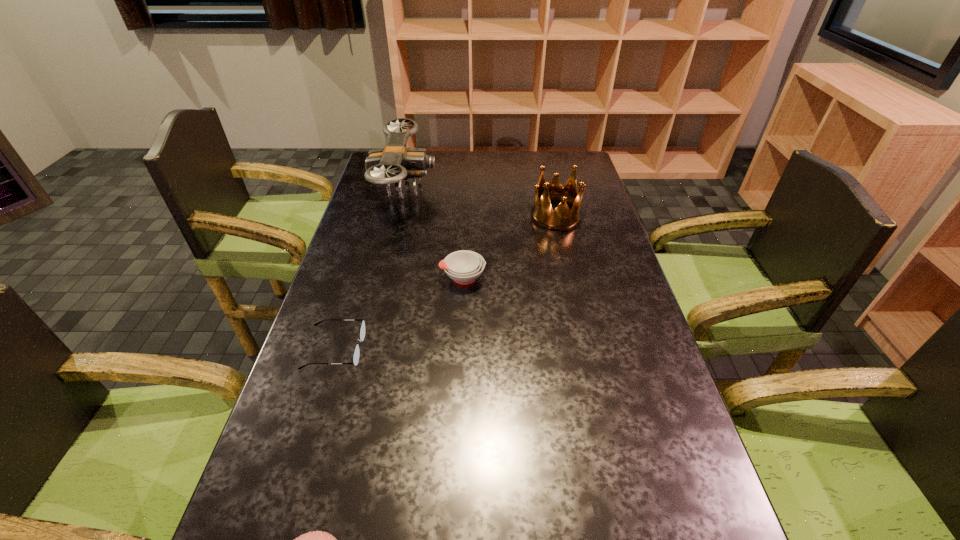
Identify the location of object at the far edge. click(x=394, y=163).

Locate an element on the screen. The width and height of the screenshot is (960, 540). drone that is positioned at the left edge is located at coordinates (394, 163).

Image resolution: width=960 pixels, height=540 pixels. What are the coordinates of `spectacles at the left edge` in the screenshot? It's located at (356, 354).

At what (x,y) coordinates should I click in order to perform the action: click on object that is at the right edge. Please return your answer as a coordinate pair (x, y). Looking at the image, I should click on (561, 218).

Where is `object that is at the far left corner`? The image size is (960, 540). object that is at the far left corner is located at coordinates (394, 163).

I want to click on free space at the left edge of the desktop, so click(x=357, y=336).

In the image, there is a desktop. At what (x,y) coordinates should I click in order to perform the action: click on vacant space at the right edge. Please return your answer as a coordinate pair (x, y). The height and width of the screenshot is (540, 960). Looking at the image, I should click on (601, 387).

The width and height of the screenshot is (960, 540). What are the coordinates of `free spot between the fourth object from left to right and the second nearest object` in the screenshot? It's located at (399, 313).

Locate an element on the screen. free space that is in between the crown and the fourth farthest object is located at coordinates (445, 282).

I want to click on vacant space in between the rightmost object and the third shortest object, so click(x=510, y=247).